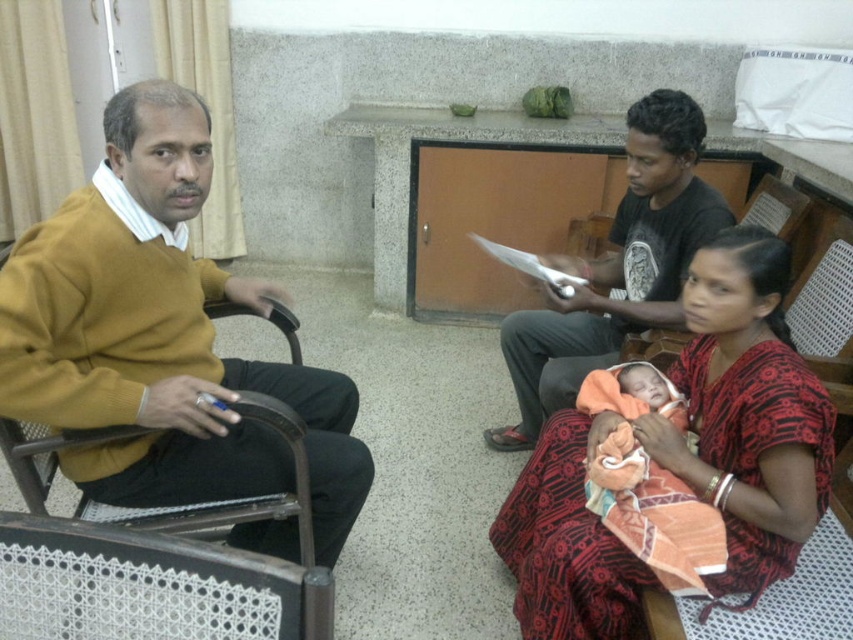
Question: Which object is the closest to the black cotton shirt at center?

Choices:
 (A) red printed sari at lower right
 (B) mustard yellow sweater at left

Answer: (A)

Question: Is mustard yellow sweater at left closer to camera compared to black cotton shirt at center?

Choices:
 (A) no
 (B) yes

Answer: (B)

Question: Can you confirm if mustard yellow sweater at left is smaller than black cotton shirt at center?

Choices:
 (A) no
 (B) yes

Answer: (B)

Question: Considering the real-world distances, which object is farthest from the black cotton shirt at center?

Choices:
 (A) mustard yellow sweater at left
 (B) red printed sari at lower right

Answer: (A)

Question: Where is red printed sari at lower right located in relation to black cotton shirt at center in the image?

Choices:
 (A) left
 (B) right

Answer: (B)

Question: Which point is farther to the camera?

Choices:
 (A) (631, 221)
 (B) (781, 314)

Answer: (A)